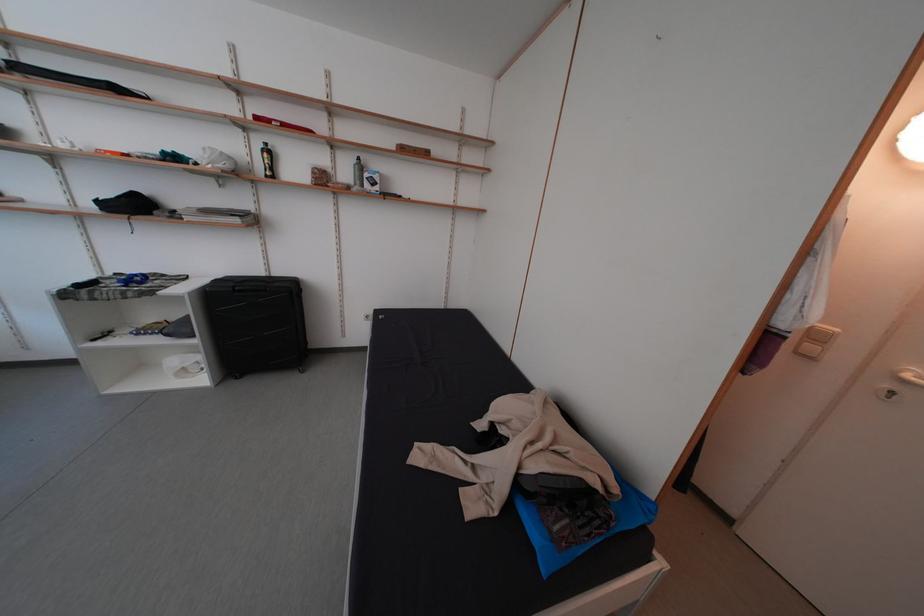
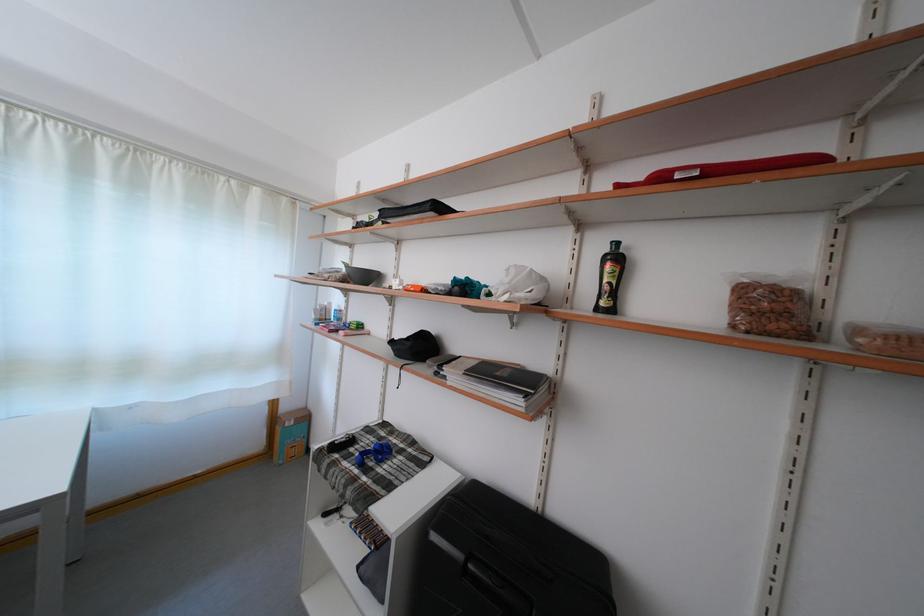
Locate, in the second image, the point that corresponds to the point at 247,225 in the first image.

(527, 408)